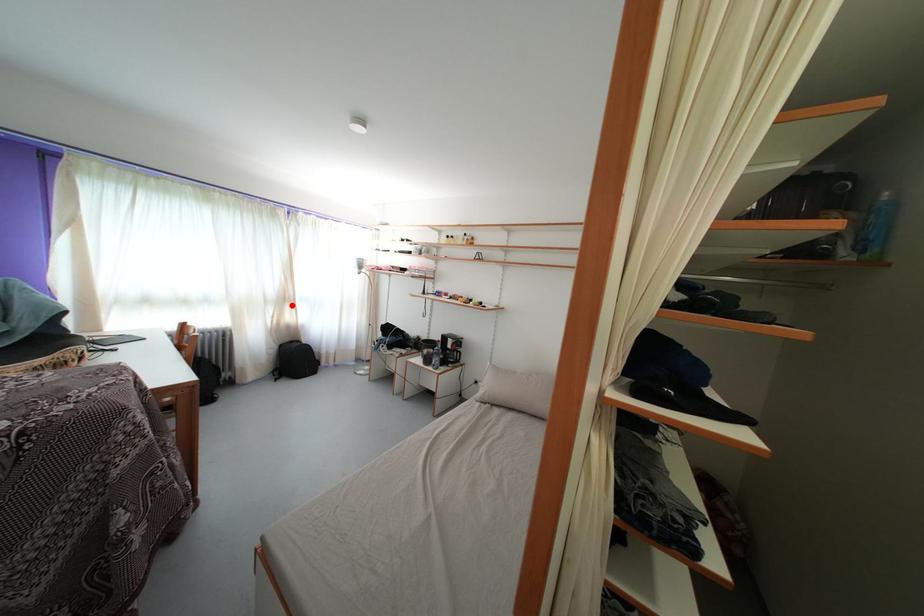
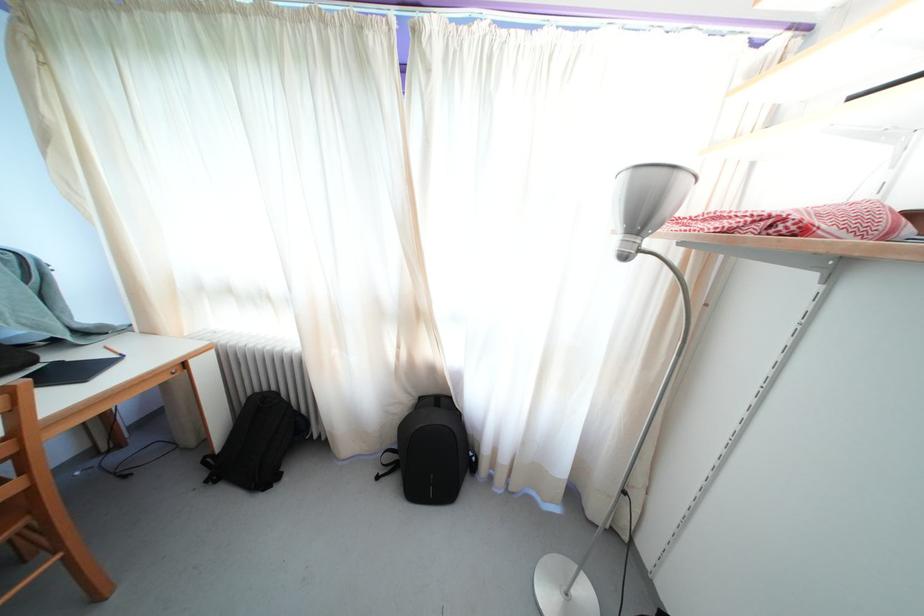
Locate, in the second image, the point that corresponds to the highlighted location in the first image.

(421, 321)